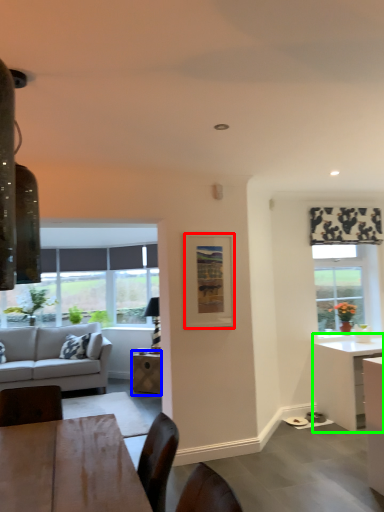
Question: Considering the real-world distances, which object is farthest from picture frame (highlighted by a red box)? table (highlighted by a blue box) or desk (highlighted by a green box)?

Choices:
 (A) table
 (B) desk

Answer: (A)